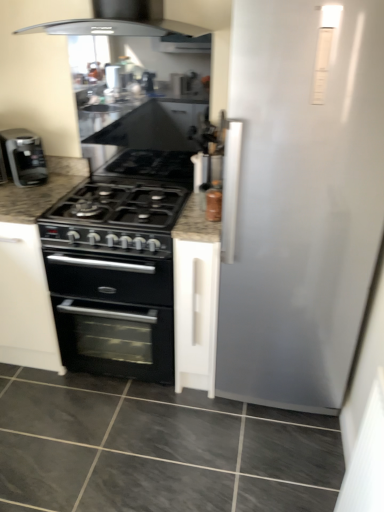
Question: Should I look upward or downward to see black matte coffee machine at left?

Choices:
 (A) down
 (B) up

Answer: (B)

Question: Is granite black stove at center directly adjacent to black matte coffee machine at left?

Choices:
 (A) no
 (B) yes

Answer: (A)

Question: Is granite black stove at center not within black matte coffee machine at left?

Choices:
 (A) yes
 (B) no

Answer: (A)

Question: Is granite black stove at center taller than black matte coffee machine at left?

Choices:
 (A) yes
 (B) no

Answer: (B)

Question: Is granite black stove at center to the left of black matte coffee machine at left from the viewer's perspective?

Choices:
 (A) no
 (B) yes

Answer: (A)

Question: Could black matte coffee machine at left be considered to be inside granite black stove at center?

Choices:
 (A) no
 (B) yes

Answer: (A)

Question: From the image's perspective, is granite black stove at center below black matte coffee machine at left?

Choices:
 (A) no
 (B) yes

Answer: (B)

Question: Is metallic silver spice jar at upper right beside granite black stove at center?

Choices:
 (A) no
 (B) yes

Answer: (A)

Question: Does metallic silver spice jar at upper right have a greater height compared to granite black stove at center?

Choices:
 (A) yes
 (B) no

Answer: (A)

Question: Does metallic silver spice jar at upper right have a smaller size compared to granite black stove at center?

Choices:
 (A) no
 (B) yes

Answer: (B)

Question: Considering the relative sizes of metallic silver spice jar at upper right and granite black stove at center in the image provided, is metallic silver spice jar at upper right shorter than granite black stove at center?

Choices:
 (A) no
 (B) yes

Answer: (A)

Question: Could you tell me if metallic silver spice jar at upper right is turned towards granite black stove at center?

Choices:
 (A) yes
 (B) no

Answer: (B)

Question: Could granite black stove at center be considered to be inside metallic silver spice jar at upper right?

Choices:
 (A) no
 (B) yes

Answer: (A)

Question: From the image's perspective, is gray marble floor at lower center located above black matte coffee machine at left?

Choices:
 (A) yes
 (B) no

Answer: (B)